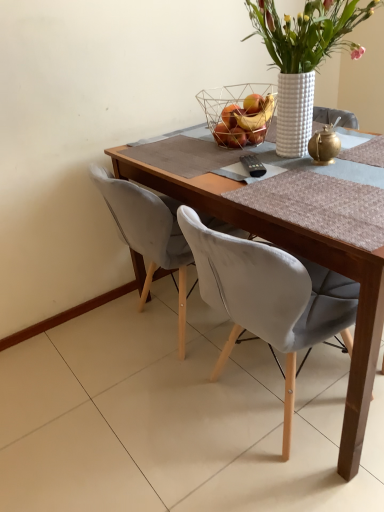
Question: Does wire mesh basket at upper center have a lesser height compared to gold metallic teapot at upper right?

Choices:
 (A) no
 (B) yes

Answer: (A)

Question: Is there a large distance between wire mesh basket at upper center and gold metallic teapot at upper right?

Choices:
 (A) yes
 (B) no

Answer: (B)

Question: From the image's perspective, would you say wire mesh basket at upper center is shown under gold metallic teapot at upper right?

Choices:
 (A) yes
 (B) no

Answer: (B)

Question: Is wire mesh basket at upper center further to the viewer compared to gold metallic teapot at upper right?

Choices:
 (A) yes
 (B) no

Answer: (A)

Question: From a real-world perspective, is wire mesh basket at upper center under gold metallic teapot at upper right?

Choices:
 (A) yes
 (B) no

Answer: (B)

Question: Can you confirm if wire mesh basket at upper center is positioned to the right of gold metallic teapot at upper right?

Choices:
 (A) yes
 (B) no

Answer: (B)

Question: Does white textured vase at upper center come behind gold metallic teapot at upper right?

Choices:
 (A) no
 (B) yes

Answer: (A)

Question: Can you confirm if white textured vase at upper center is wider than gold metallic teapot at upper right?

Choices:
 (A) yes
 (B) no

Answer: (A)

Question: From the image's perspective, is white textured vase at upper center below gold metallic teapot at upper right?

Choices:
 (A) no
 (B) yes

Answer: (A)

Question: From a real-world perspective, is white textured vase at upper center over gold metallic teapot at upper right?

Choices:
 (A) no
 (B) yes

Answer: (B)

Question: From a real-world perspective, is white textured vase at upper center beneath gold metallic teapot at upper right?

Choices:
 (A) yes
 (B) no

Answer: (B)

Question: Does white textured vase at upper center turn towards gold metallic teapot at upper right?

Choices:
 (A) no
 (B) yes

Answer: (A)

Question: Is wooden table at center positioned before white textured vase at upper center?

Choices:
 (A) yes
 (B) no

Answer: (A)